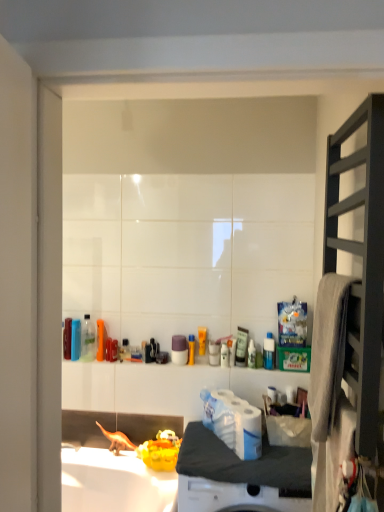
Question: From a real-world perspective, relative to white glossy toilet paper at center, is white matte counter top at center vertically above or below?

Choices:
 (A) above
 (B) below

Answer: (B)

Question: Is white matte counter top at center in front of or behind white glossy toilet paper at center in the image?

Choices:
 (A) front
 (B) behind

Answer: (A)

Question: Estimate the real-world distances between objects in this image. Which object is farther from the dark wood shelf at right?

Choices:
 (A) white glossy toilet paper at center
 (B) white matte counter top at center

Answer: (A)

Question: Estimate the real-world distances between objects in this image. Which object is farther from the white matte counter top at center?

Choices:
 (A) white glossy toilet paper at center
 (B) dark wood shelf at right

Answer: (B)